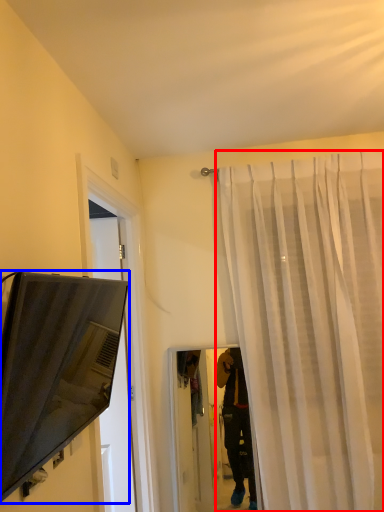
Question: Which object is closer to the camera taking this photo, curtain (highlighted by a red box) or television (highlighted by a blue box)?

Choices:
 (A) curtain
 (B) television

Answer: (B)